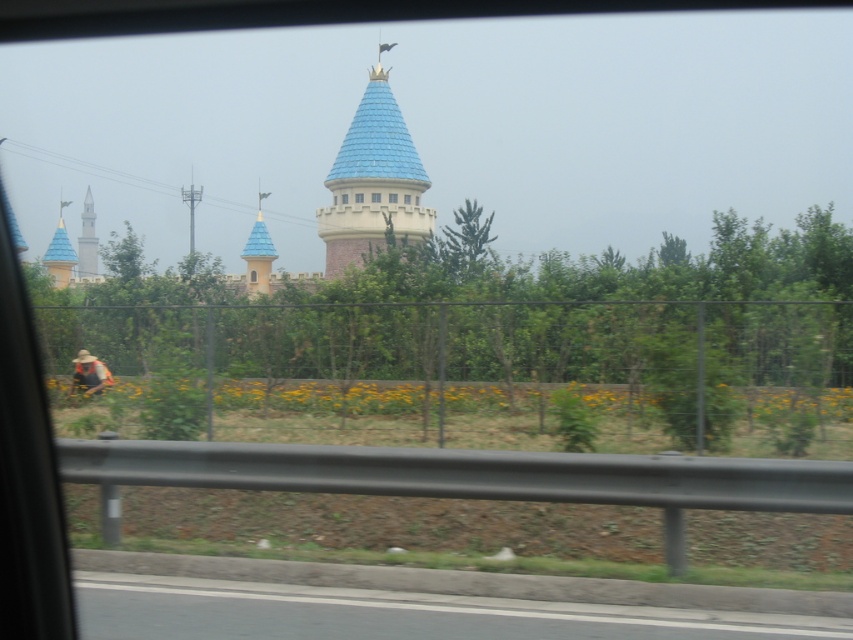
You are a passenger in a car driving past a castle with a blue glossy spire at left and a camouflage fabric man at lower left. From your perspective inside the car, which object is higher in the scene?

The blue glossy spire at left is higher than the camouflage fabric man at lower left because the description states that the blue glossy spire at left is above the camouflage fabric man at lower left.

You are sitting in a car and looking out the window. You see two points marked in the scene. Which point is closer to you, point at coordinate (97, 384) or point at coordinate (91, 268)?

Point at coordinate (97, 384) is closer to you than point at coordinate (91, 268).

You are a passenger in a car and notice the camouflage fabric man at lower left and the white concrete tower at left outside the window. Which object is closer to the car window?

The camouflage fabric man at lower left is closer to the car window because it is positioned on the right side of the white concrete tower at left, which is further away.